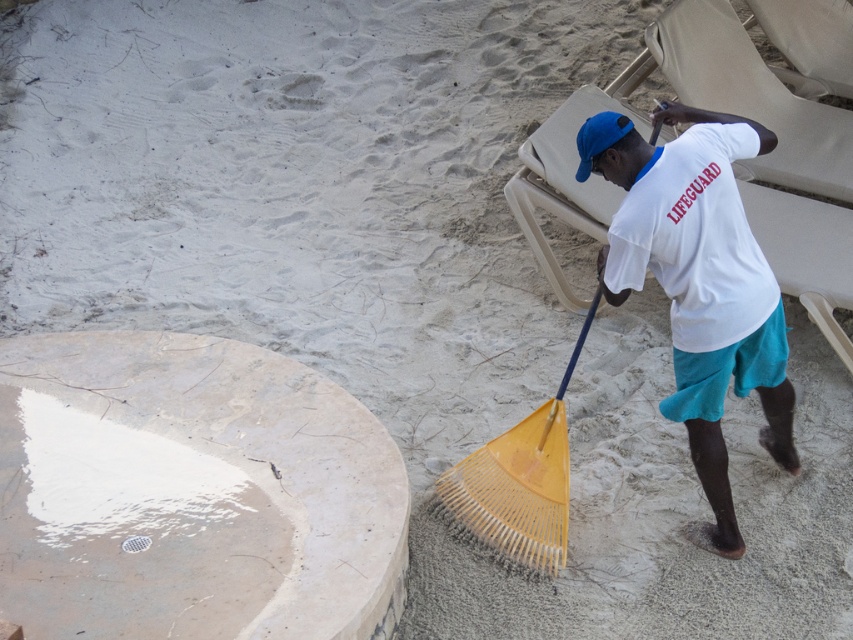
Is white cotton shirt at center taller than blue fabric baseball cap at upper center?

Indeed, white cotton shirt at center has a greater height compared to blue fabric baseball cap at upper center.

Does white cotton shirt at center have a smaller size compared to blue fabric baseball cap at upper center?

Actually, white cotton shirt at center might be larger than blue fabric baseball cap at upper center.

The width and height of the screenshot is (853, 640). Find the location of `white cotton shirt at center`. white cotton shirt at center is located at coordinates (701, 289).

Does point (294, 474) come farther from viewer compared to point (706, 220)?

Yes, it is behind point (706, 220).

Is white marble cement at lower left smaller than white cotton shirt at center?

Actually, white marble cement at lower left might be larger than white cotton shirt at center.

Which is behind, point (299, 545) or point (733, 348)?

Point (733, 348)

Image resolution: width=853 pixels, height=640 pixels. Find the location of `white marble cement at lower left`. white marble cement at lower left is located at coordinates click(190, 492).

In the scene shown: Which is above, white marble cement at lower left or blue fabric baseball cap at upper center?

blue fabric baseball cap at upper center

Who is shorter, white marble cement at lower left or blue fabric baseball cap at upper center?

blue fabric baseball cap at upper center is shorter.

I want to click on white marble cement at lower left, so click(190, 492).